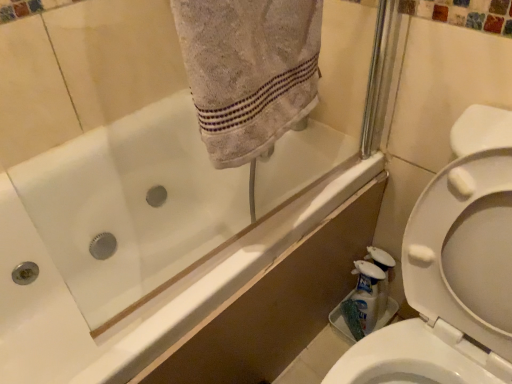
Question: From the image's perspective, is white glossy bottle at lower right, which is the 1th cleaning product from right to left, below white glossy bathtub at upper left?

Choices:
 (A) yes
 (B) no

Answer: (A)

Question: Does white glossy bottle at lower right, which is the 1th cleaning product from right to left, have a greater height compared to white glossy bathtub at upper left?

Choices:
 (A) no
 (B) yes

Answer: (A)

Question: Is white glossy bottle at lower right, the 2th cleaning product in the left-to-right sequence, beside white glossy bathtub at upper left?

Choices:
 (A) yes
 (B) no

Answer: (B)

Question: Is white glossy bottle at lower right, the 2th cleaning product in the left-to-right sequence, positioned before white glossy bathtub at upper left?

Choices:
 (A) yes
 (B) no

Answer: (B)

Question: Does white glossy bottle at lower right, the 2th cleaning product in the left-to-right sequence, lie behind white glossy bathtub at upper left?

Choices:
 (A) no
 (B) yes

Answer: (B)

Question: Does point (116, 238) appear closer or farther from the camera than point (313, 24)?

Choices:
 (A) closer
 (B) farther

Answer: (B)

Question: From the image's perspective, relative to gray cotton towel at upper center, is white glossy bathtub at upper left above or below?

Choices:
 (A) below
 (B) above

Answer: (A)

Question: Would you say white glossy bathtub at upper left is to the left or to the right of gray cotton towel at upper center in the picture?

Choices:
 (A) left
 (B) right

Answer: (B)

Question: From a real-world perspective, is white glossy bathtub at upper left physically located above or below gray cotton towel at upper center?

Choices:
 (A) below
 (B) above

Answer: (A)

Question: Is point (349, 311) positioned closer to the camera than point (161, 258)?

Choices:
 (A) farther
 (B) closer

Answer: (B)

Question: Relative to white glossy bathtub at upper left, is white plastic bottle at lower right, placed as the 2th cleaning product when sorted from right to left, in front or behind?

Choices:
 (A) behind
 (B) front

Answer: (A)

Question: Considering the positions of white plastic bottle at lower right, placed as the 2th cleaning product when sorted from right to left, and white glossy bathtub at upper left in the image, is white plastic bottle at lower right, placed as the 2th cleaning product when sorted from right to left, wider or thinner than white glossy bathtub at upper left?

Choices:
 (A) thin
 (B) wide

Answer: (A)

Question: From a real-world perspective, relative to white glossy bathtub at upper left, is white plastic bottle at lower right, placed as the 2th cleaning product when sorted from right to left, vertically above or below?

Choices:
 (A) above
 (B) below

Answer: (B)

Question: Choose the correct answer: Is gray cotton towel at upper center inside white glossy bottle at lower right, which is the 1th cleaning product from right to left, or outside it?

Choices:
 (A) outside
 (B) inside

Answer: (A)

Question: Is gray cotton towel at upper center bigger or smaller than white glossy bottle at lower right, the 2th cleaning product in the left-to-right sequence?

Choices:
 (A) small
 (B) big

Answer: (B)